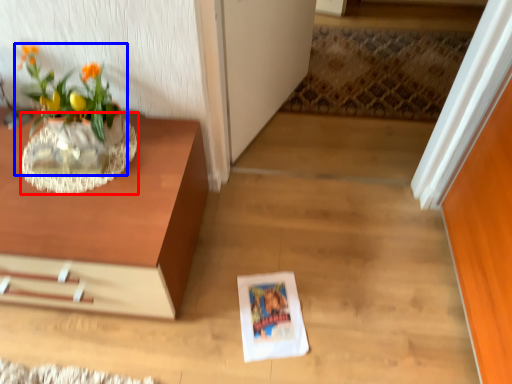
Question: Which object appears closest to the camera in this image, vase (highlighted by a red box) or houseplant (highlighted by a blue box)?

Choices:
 (A) vase
 (B) houseplant

Answer: (B)